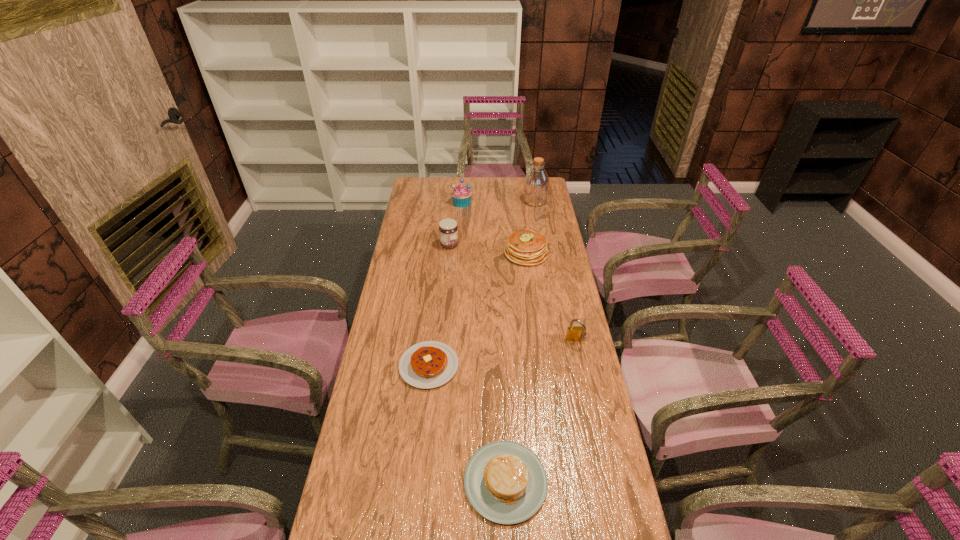
Where is `free space located 0.190m on the back of the tallest object`? free space located 0.190m on the back of the tallest object is located at coordinates (531, 178).

At what (x,y) coordinates should I click in order to perform the action: click on free space located on the front of the muffin. Please return your answer as a coordinate pair (x, y). The image size is (960, 540). Looking at the image, I should click on (460, 235).

This screenshot has height=540, width=960. I want to click on free spot located 0.320m on the front label of the jam, so tap(529, 245).

This screenshot has width=960, height=540. Identify the location of free space located 0.060m on the side with the combination dials of the padlock. (580, 360).

In order to click on vacant position located 0.380m on the left of the fifth tallest object in this screenshot , I will do [x=418, y=253].

The width and height of the screenshot is (960, 540). I want to click on vacant space located 0.090m on the back of the sixth tallest object, so click(503, 415).

This screenshot has height=540, width=960. I want to click on vacant area situated on the front of the leftmost pancake, so click(419, 464).

I want to click on bottle positioned at the far edge, so click(536, 184).

Where is `muffin that is at the far edge`? The height and width of the screenshot is (540, 960). muffin that is at the far edge is located at coordinates (461, 195).

Locate an element on the screen. Image resolution: width=960 pixels, height=540 pixels. object situated at the left edge is located at coordinates (429, 364).